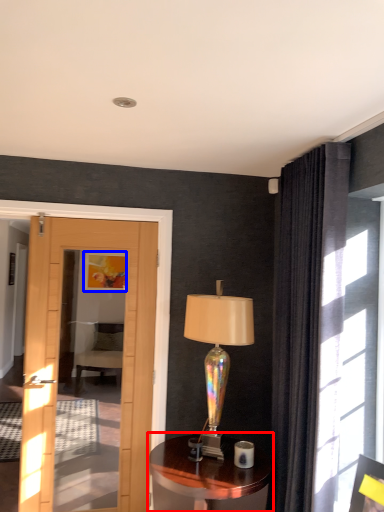
Question: Which of the following is the closest to the observer, table (highlighted by a red box) or picture frame (highlighted by a blue box)?

Choices:
 (A) table
 (B) picture frame

Answer: (A)